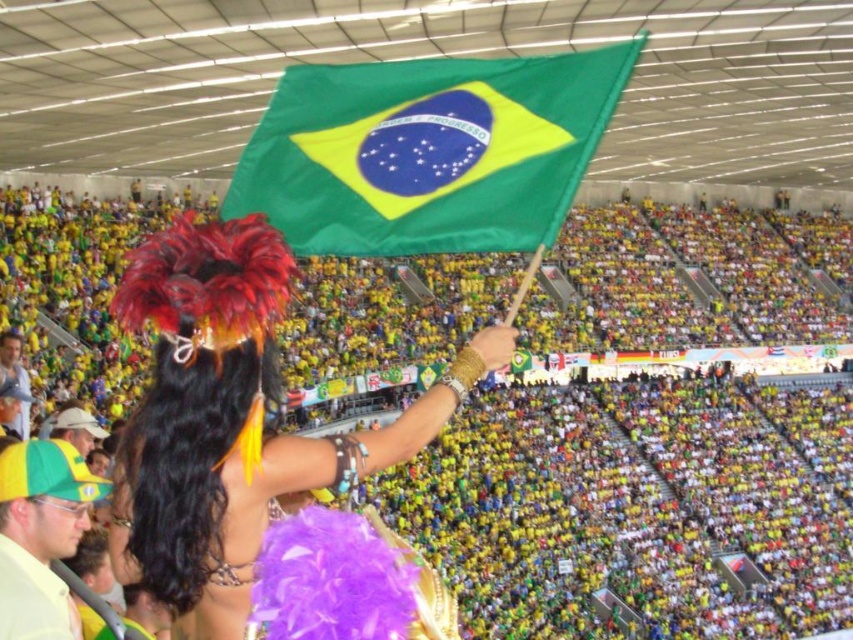
Can you confirm if feathered headdress at center is positioned to the right of green fabric flag at center?

Incorrect, feathered headdress at center is not on the right side of green fabric flag at center.

Can you confirm if feathered headdress at center is positioned below green fabric flag at center?

Indeed, feathered headdress at center is positioned under green fabric flag at center.

From the picture: Who is more distant from viewer, (x=132, y=525) or (x=556, y=68)?

The point (x=556, y=68) is more distant.

Find the location of a particular element. This screenshot has width=853, height=640. feathered headdress at center is located at coordinates (233, 419).

Does feathered headdress at center have a lesser width compared to smooth skin face at lower left?

In fact, feathered headdress at center might be wider than smooth skin face at lower left.

Is point (287, 470) positioned after point (15, 419)?

No, (287, 470) is closer to viewer.

Is point (212, 509) more distant than point (25, 371)?

No, it is not.

In order to click on feathered headdress at center in this screenshot , I will do `click(233, 419)`.

Can you confirm if yellow fabric cap at upper left is positioned below smooth skin face at lower left?

Yes, yellow fabric cap at upper left is below smooth skin face at lower left.

Which is in front, point (15, 508) or point (26, 417)?

Point (15, 508) is more forward.

Image resolution: width=853 pixels, height=640 pixels. Find the location of `yellow fabric cap at upper left`. yellow fabric cap at upper left is located at coordinates (41, 534).